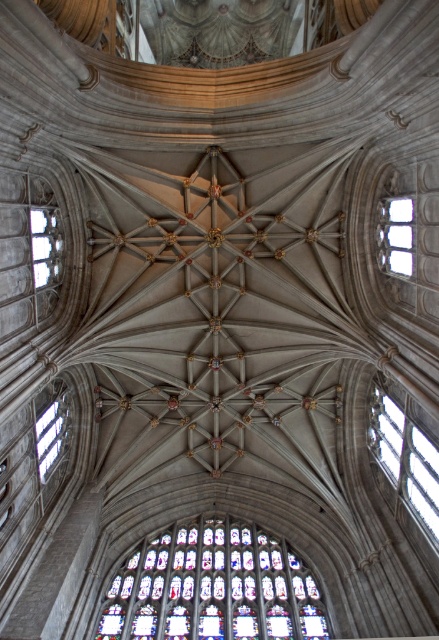
In the cathedral scene, there is a clear glass window at left and a point marked at coordinates point (45, 244). Which object is located at the specified coordinates?

The clear glass window at left is located at point (45, 244).

You are an architect analyzing the cathedral ceiling. You observe the clear glass window at right and the clear glass window at upper right. Which of these two windows has a greater width?

The clear glass window at upper right has a greater width than the clear glass window at right.